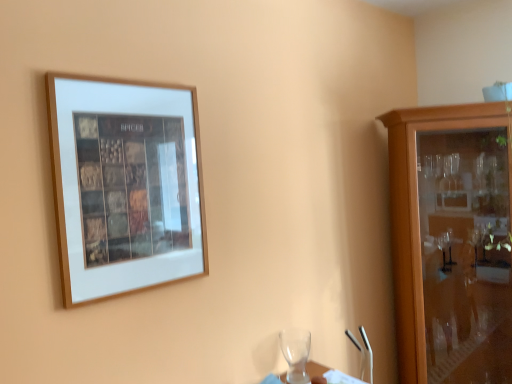
Question: From a real-world perspective, is wooden picture frame at upper left physically below transparent glass wine glass at lower center?

Choices:
 (A) no
 (B) yes

Answer: (A)

Question: Is wooden picture frame at upper left wider than transparent glass wine glass at lower center?

Choices:
 (A) yes
 (B) no

Answer: (B)

Question: Is wooden picture frame at upper left turned away from transparent glass wine glass at lower center?

Choices:
 (A) yes
 (B) no

Answer: (B)

Question: Is wooden picture frame at upper left at the left side of transparent glass wine glass at lower center?

Choices:
 (A) no
 (B) yes

Answer: (B)

Question: Does wooden picture frame at upper left lie behind transparent glass wine glass at lower center?

Choices:
 (A) yes
 (B) no

Answer: (B)

Question: Is wooden picture frame at upper left shorter than transparent glass wine glass at lower center?

Choices:
 (A) yes
 (B) no

Answer: (B)

Question: From a real-world perspective, is wooden cabinet at right located higher than wooden picture frame at upper left?

Choices:
 (A) no
 (B) yes

Answer: (A)

Question: Is wooden cabinet at right facing away from wooden picture frame at upper left?

Choices:
 (A) yes
 (B) no

Answer: (B)

Question: Considering the relative sizes of wooden cabinet at right and wooden picture frame at upper left in the image provided, is wooden cabinet at right bigger than wooden picture frame at upper left?

Choices:
 (A) no
 (B) yes

Answer: (B)

Question: Is wooden cabinet at right placed right next to wooden picture frame at upper left?

Choices:
 (A) yes
 (B) no

Answer: (B)

Question: Can you confirm if wooden cabinet at right is smaller than wooden picture frame at upper left?

Choices:
 (A) no
 (B) yes

Answer: (A)

Question: Would you consider wooden cabinet at right to be distant from wooden picture frame at upper left?

Choices:
 (A) yes
 (B) no

Answer: (A)

Question: Can you confirm if wooden picture frame at upper left is shorter than wooden cabinet at right?

Choices:
 (A) no
 (B) yes

Answer: (B)